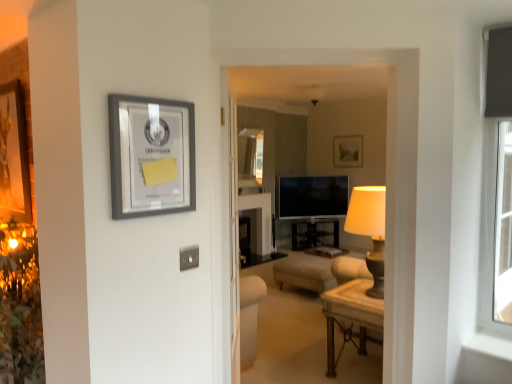
Question: Is wooden polished table at center inside matte gray picture frame at upper left?

Choices:
 (A) yes
 (B) no

Answer: (B)

Question: Can you confirm if matte gray picture frame at upper left is taller than wooden polished table at center?

Choices:
 (A) no
 (B) yes

Answer: (A)

Question: From a real-world perspective, is matte gray picture frame at upper left below wooden polished table at center?

Choices:
 (A) no
 (B) yes

Answer: (A)

Question: Could you tell me if matte gray picture frame at upper left is turned towards wooden polished table at center?

Choices:
 (A) yes
 (B) no

Answer: (B)

Question: Considering the relative sizes of matte gray picture frame at upper left and wooden polished table at center in the image provided, is matte gray picture frame at upper left thinner than wooden polished table at center?

Choices:
 (A) yes
 (B) no

Answer: (A)

Question: Considering the relative positions of matte gray picture frame at upper left and wooden polished table at center in the image provided, is matte gray picture frame at upper left in front of wooden polished table at center?

Choices:
 (A) yes
 (B) no

Answer: (A)

Question: From the image's perspective, would you say matte black tv at center is positioned over matte gray picture frame at upper left?

Choices:
 (A) no
 (B) yes

Answer: (A)

Question: Does matte black tv at center appear on the left side of matte gray picture frame at upper left?

Choices:
 (A) yes
 (B) no

Answer: (B)

Question: From a real-world perspective, is matte black tv at center on top of matte gray picture frame at upper left?

Choices:
 (A) yes
 (B) no

Answer: (B)

Question: From the image's perspective, is matte black tv at center below matte gray picture frame at upper left?

Choices:
 (A) yes
 (B) no

Answer: (A)

Question: Considering the relative sizes of matte black tv at center and matte gray picture frame at upper left in the image provided, is matte black tv at center bigger than matte gray picture frame at upper left?

Choices:
 (A) yes
 (B) no

Answer: (A)

Question: Could you tell me if matte black tv at center is turned towards matte gray picture frame at upper left?

Choices:
 (A) yes
 (B) no

Answer: (A)

Question: From a real-world perspective, is wooden polished table at center under matte gray picture frame at upper left?

Choices:
 (A) no
 (B) yes

Answer: (B)